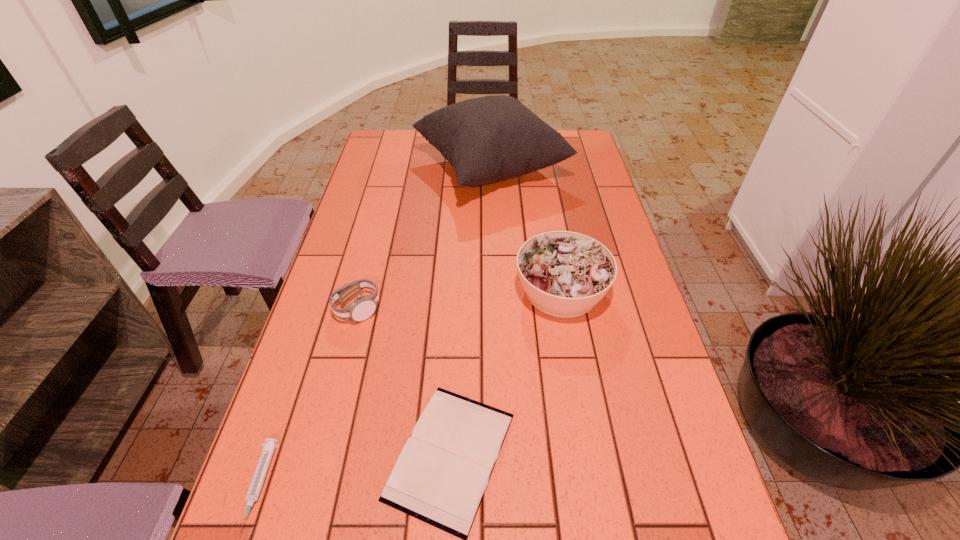
Find the location of a particular element. Image resolution: width=960 pixels, height=540 pixels. the farthest object is located at coordinates (488, 139).

Find the location of `the tallest object`. the tallest object is located at coordinates (488, 139).

Where is `the fourth shortest object`? This screenshot has width=960, height=540. the fourth shortest object is located at coordinates tap(565, 274).

Where is `the third shortest object`? This screenshot has height=540, width=960. the third shortest object is located at coordinates (363, 307).

Where is `the fourth object from right to left`? This screenshot has width=960, height=540. the fourth object from right to left is located at coordinates (363, 307).

At what (x,y) coordinates should I click in order to perform the action: click on the leftmost object. Please return your answer as a coordinate pair (x, y). This screenshot has width=960, height=540. Looking at the image, I should click on (253, 493).

At what (x,y) coordinates should I click in order to perform the action: click on blank area located 0.160m on the front of the cushion. Please return your answer as a coordinate pair (x, y). Looking at the image, I should click on (493, 251).

Locate an element on the screen. vacant space situated on the back of the second tallest object is located at coordinates (x=552, y=238).

Locate an element on the screen. vacant space positioned 0.390m on the face of the second object from left to right is located at coordinates (539, 309).

This screenshot has width=960, height=540. I want to click on object positioned at the far edge, so click(488, 139).